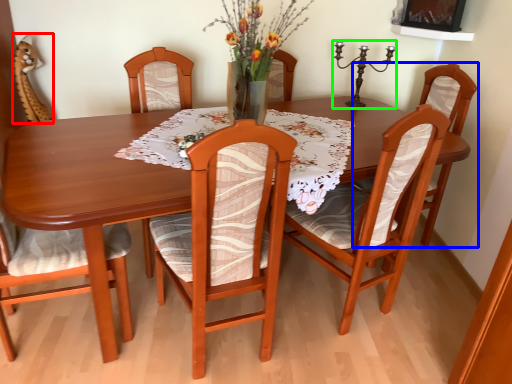
Question: Based on their relative distances, which object is nearer to armchair (highlighted by a red box)? Choose from chair (highlighted by a blue box) and candle holder (highlighted by a green box).

Choices:
 (A) chair
 (B) candle holder

Answer: (B)